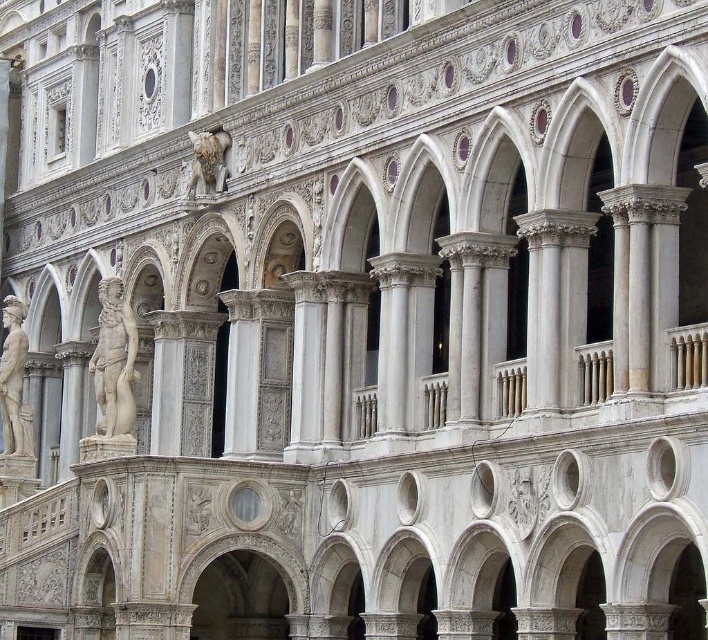
Who is lower down, white marble statue at center or polished stone lion at upper center?

white marble statue at center is lower down.

Is white marble statue at center above polished stone lion at upper center?

No.

Between point (122, 420) and point (222, 172), which one is positioned behind?

Positioned behind is point (222, 172).

The image size is (708, 640). In order to click on white marble statue at center in this screenshot , I will do `click(114, 360)`.

Measure the distance between point (x=108, y=317) and camera.

71.24 meters

Find the location of a particular element. This screenshot has width=708, height=640. white marble statue at center is located at coordinates (114, 360).

Where is `white marble statue at center`? This screenshot has width=708, height=640. white marble statue at center is located at coordinates (114, 360).

Who is taller, white marble statue at left or polished stone lion at upper center?

With more height is white marble statue at left.

The height and width of the screenshot is (640, 708). What are the coordinates of `white marble statue at left` in the screenshot? It's located at (13, 380).

Where is `white marble statue at left`? This screenshot has width=708, height=640. white marble statue at left is located at coordinates (13, 380).